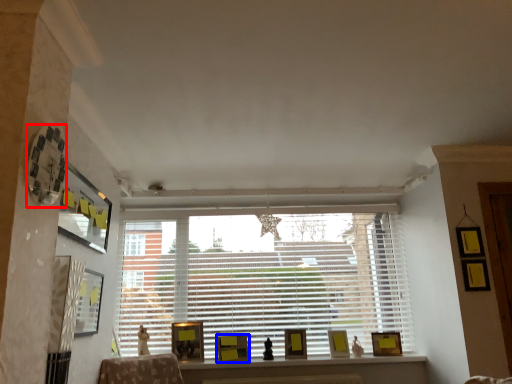
Question: Which object is closer to the camera taking this photo, picture frame (highlighted by a red box) or picture frame (highlighted by a blue box)?

Choices:
 (A) picture frame
 (B) picture frame

Answer: (A)